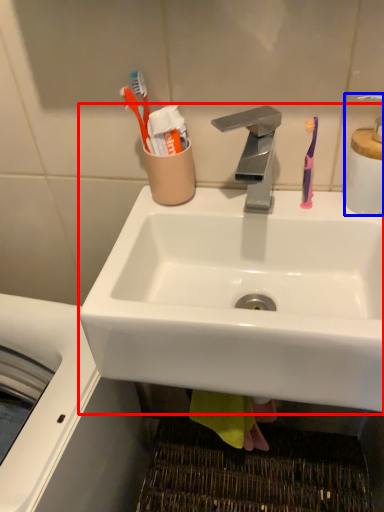
Question: Which point is closer to the camera, sink (highlighted by a red box) or soap dispenser (highlighted by a blue box)?

Choices:
 (A) sink
 (B) soap dispenser

Answer: (A)